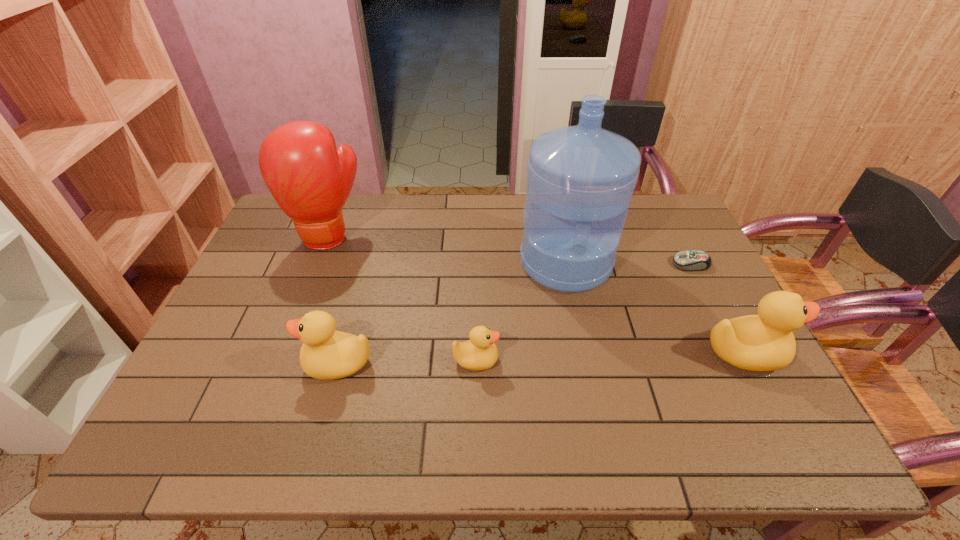
Where is `free region located at the beak of the leftmost duck`? The image size is (960, 540). free region located at the beak of the leftmost duck is located at coordinates (220, 363).

You are a GUI agent. You are given a task and a screenshot of the screen. Output one action in this format:
    pyautogui.click(x=<x>, y=<y>)
    Task: Click on the vacant space positioned 0.270m at the beak of the leftmost duck
    
    Given the screenshot: What is the action you would take?
    pyautogui.click(x=195, y=363)

You are a GUI agent. You are given a task and a screenshot of the screen. Output one action in this format:
    pyautogui.click(x=<x>, y=<y>)
    Task: Click on the vacant point located 0.120m at the beak of the fifth tallest object
    
    Given the screenshot: What is the action you would take?
    pyautogui.click(x=546, y=360)

This screenshot has height=540, width=960. Identify the location of free space located 0.270m on the wheel side of the shortest object. (584, 264).

You are a GUI agent. You are given a task and a screenshot of the screen. Output one action in this format:
    pyautogui.click(x=<x>, y=<y>)
    Task: Click on the vacant space situated 0.140m on the wheel side of the shortest object
    
    Given the screenshot: What is the action you would take?
    pyautogui.click(x=627, y=264)

Where is `blank area located 0.250m on the wheel side of the shortest object`? This screenshot has width=960, height=540. blank area located 0.250m on the wheel side of the shortest object is located at coordinates (590, 264).

Where is `free location located on the side of the tallest object with the handle`? The width and height of the screenshot is (960, 540). free location located on the side of the tallest object with the handle is located at coordinates (593, 395).

This screenshot has height=540, width=960. What are the coordinates of `vacant space positioned 0.090m on the striking surface of the second tallest object` in the screenshot? It's located at (312, 280).

I want to click on water jug that is at the far edge, so click(x=580, y=179).

Find the location of a particular element. The height and width of the screenshot is (540, 960). boxing glove that is at the far edge is located at coordinates (310, 180).